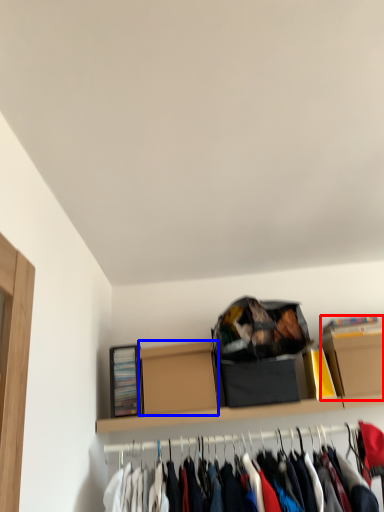
Question: Which object appears farthest to the camera in this image, cardboard box (highlighted by a red box) or cardboard box (highlighted by a blue box)?

Choices:
 (A) cardboard box
 (B) cardboard box

Answer: (A)